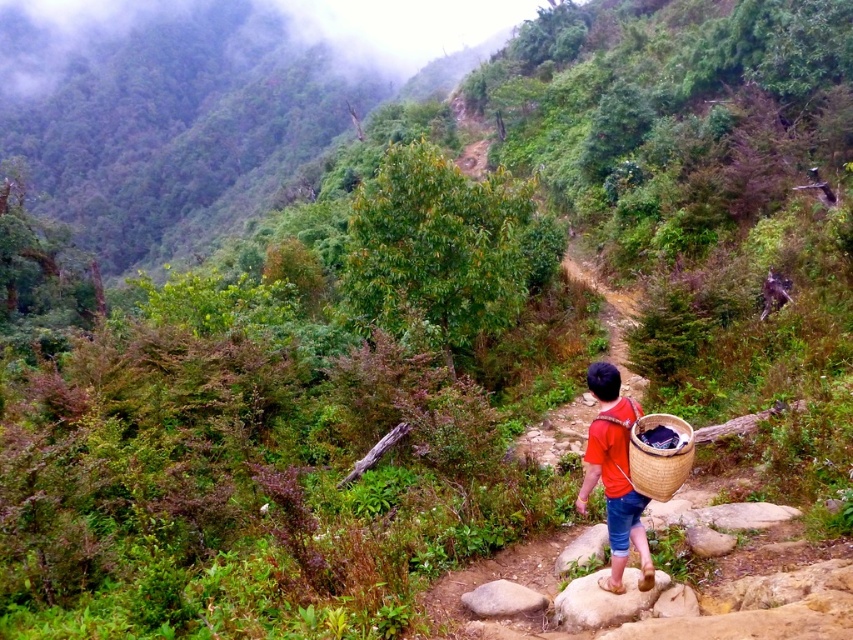
In the scene shown: Is red woven basket at center to the right of woven bamboo basket at lower right from the viewer's perspective?

In fact, red woven basket at center is to the left of woven bamboo basket at lower right.

Is point (613, 564) positioned after point (674, 468)?

Yes, it is behind point (674, 468).

Is point (618, 394) less distant than point (688, 470)?

No, (618, 394) is behind (688, 470).

I want to click on red woven basket at center, so click(614, 476).

Can you confirm if woven bamboo basket at lower right is shorter than smooth gray rock at center?

In fact, woven bamboo basket at lower right may be taller than smooth gray rock at center.

This screenshot has width=853, height=640. I want to click on woven bamboo basket at lower right, so click(x=659, y=456).

Who is shorter, red woven basket at center or smooth gray rock at center?

smooth gray rock at center is shorter.

Measure the distance between red woven basket at center and camera.

red woven basket at center is 16.51 feet from camera.

Image resolution: width=853 pixels, height=640 pixels. What do you see at coordinates (614, 476) in the screenshot?
I see `red woven basket at center` at bounding box center [614, 476].

The image size is (853, 640). Identify the location of red woven basket at center. (614, 476).